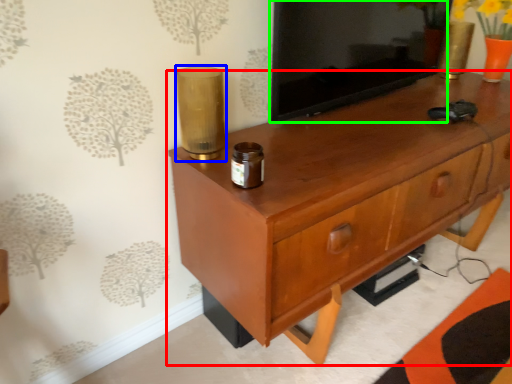
Question: Which object is the closest to the chest of drawers (highlighted by a red box)? Choose among these: candle holder (highlighted by a blue box) or tv cabinet (highlighted by a green box).

Choices:
 (A) candle holder
 (B) tv cabinet

Answer: (B)